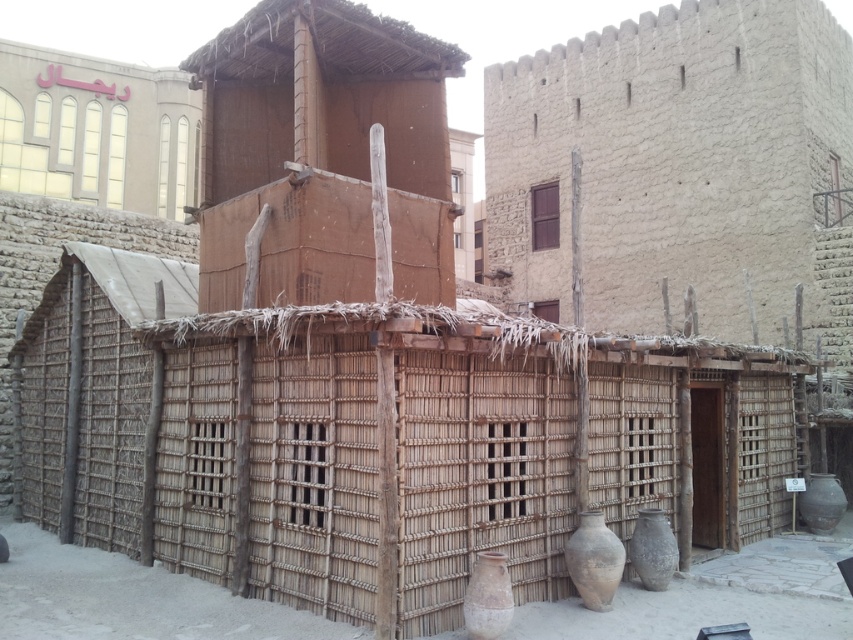
Question: Is earthy clay vase at center bigger than brown earthenware vase at lower right?

Choices:
 (A) no
 (B) yes

Answer: (A)

Question: Which of the following is the closest to the observer?

Choices:
 (A) earthy brown clay vase at lower right
 (B) brown thatched hut at upper center

Answer: (A)

Question: Can you confirm if earthy brown clay vase at lower center is wider than brown earthenware vase at lower right?

Choices:
 (A) yes
 (B) no

Answer: (B)

Question: Which is farther from the brown mud hut at center?

Choices:
 (A) earthy brown clay vase at lower right
 (B) earthy brown clay vase at lower center

Answer: (A)

Question: Is brown mud hut at center wider than brown earthenware vase at lower right?

Choices:
 (A) yes
 (B) no

Answer: (A)

Question: Considering the real-world distances, which object is closest to the brown earthenware vase at lower right?

Choices:
 (A) brown thatched hut at upper center
 (B) earthy brown clay vase at lower center
 (C) earthy brown clay vase at lower right

Answer: (C)